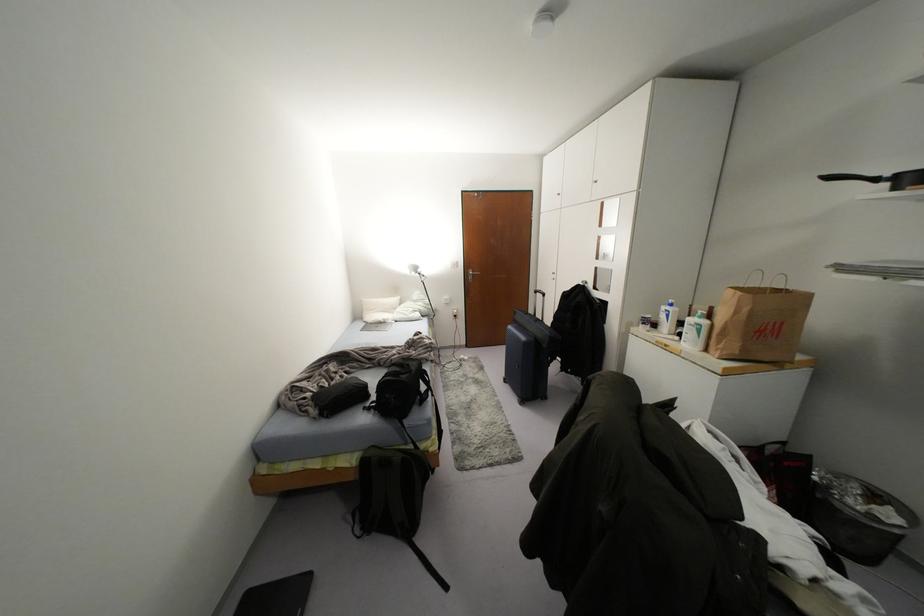
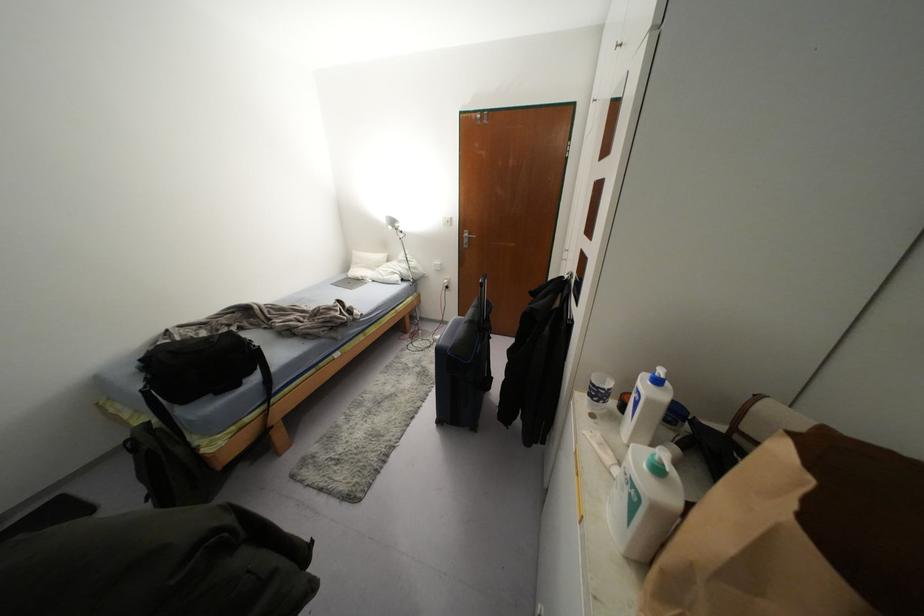
The images are taken continuously from a first-person perspective. In which direction are you moving?

The cameraman moved toward right, forward.